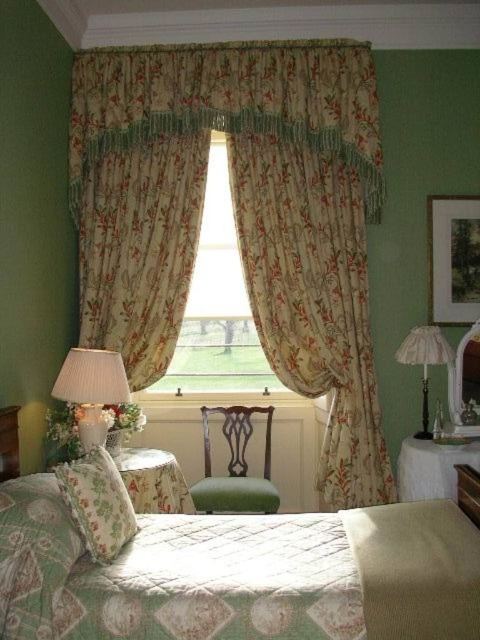
Question: From the image, what is the correct spatial relationship of floral fabric pillow at lower left in relation to brown wooden dresser at lower right?

Choices:
 (A) left
 (B) right

Answer: (A)

Question: Does white pleated fabric lampshade at left have a lesser width compared to brown wooden dresser at lower right?

Choices:
 (A) yes
 (B) no

Answer: (B)

Question: Which of the following is the closest to the observer?

Choices:
 (A) (467, 499)
 (B) (312, 225)

Answer: (A)

Question: Can you confirm if floral fabric curtains at center is positioned to the right of white fabric lampshade at right?

Choices:
 (A) yes
 (B) no

Answer: (B)

Question: Which point appears farthest from the camera in this image?

Choices:
 (A) (472, 520)
 (B) (350, 595)
 (C) (446, 353)
 (D) (193, 284)

Answer: (D)

Question: Which point is closer to the camera?

Choices:
 (A) green fabric chair at center
 (B) floral fabric curtains at center
 (C) brown wooden dresser at lower right
 (D) floral fabric pillow at lower left

Answer: (D)